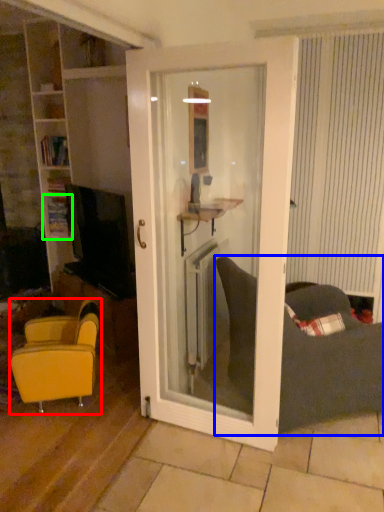
Question: Considering the real-world distances, which object is closest to chair (highlighted by a red box)? studio couch (highlighted by a blue box) or shelf (highlighted by a green box).

Choices:
 (A) studio couch
 (B) shelf

Answer: (A)